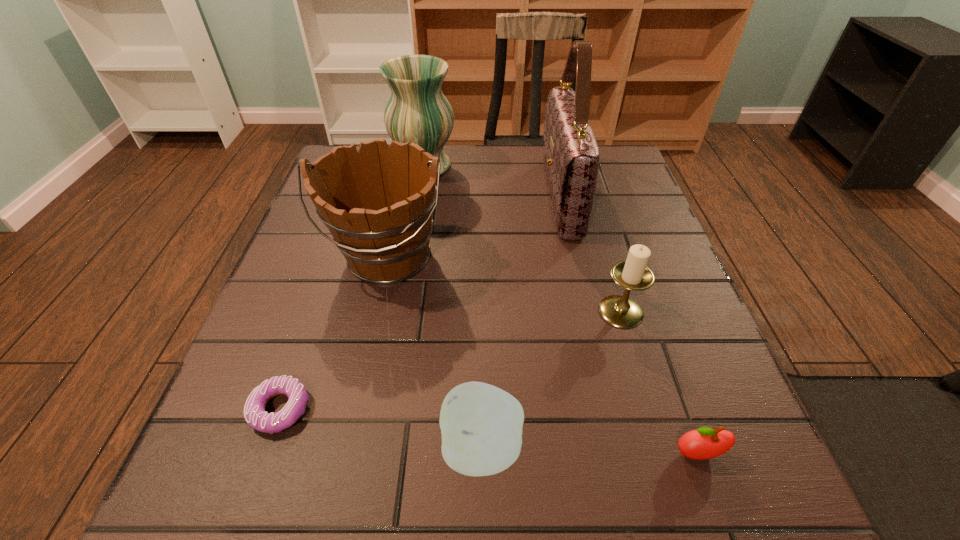
This screenshot has height=540, width=960. I want to click on vase at the left edge, so click(x=417, y=112).

Locate an element on the screen. The height and width of the screenshot is (540, 960). wine bucket that is at the left edge is located at coordinates (377, 203).

At what (x,y) coordinates should I click in order to perform the action: click on doughnut located in the left edge section of the desktop. Please return your answer as a coordinate pair (x, y). The width and height of the screenshot is (960, 540). Looking at the image, I should click on (255, 415).

Find the location of a particular element. This screenshot has width=960, height=540. handbag present at the right edge is located at coordinates [571, 156].

The height and width of the screenshot is (540, 960). In order to click on candle holder located at the right edge in this screenshot , I will do `click(633, 274)`.

Where is `apple located at the right edge`? Image resolution: width=960 pixels, height=540 pixels. apple located at the right edge is located at coordinates point(704,443).

Find the location of a particular element. object present at the far left corner is located at coordinates (417, 112).

At what (x,y) coordinates should I click in order to perform the action: click on object that is at the far right corner. Please return your answer as a coordinate pair (x, y). Looking at the image, I should click on (571, 156).

Where is `object located in the near right corner section of the desktop`? object located in the near right corner section of the desktop is located at coordinates (704, 443).

In order to click on free space at the far edge of the desktop in this screenshot , I will do `click(444, 147)`.